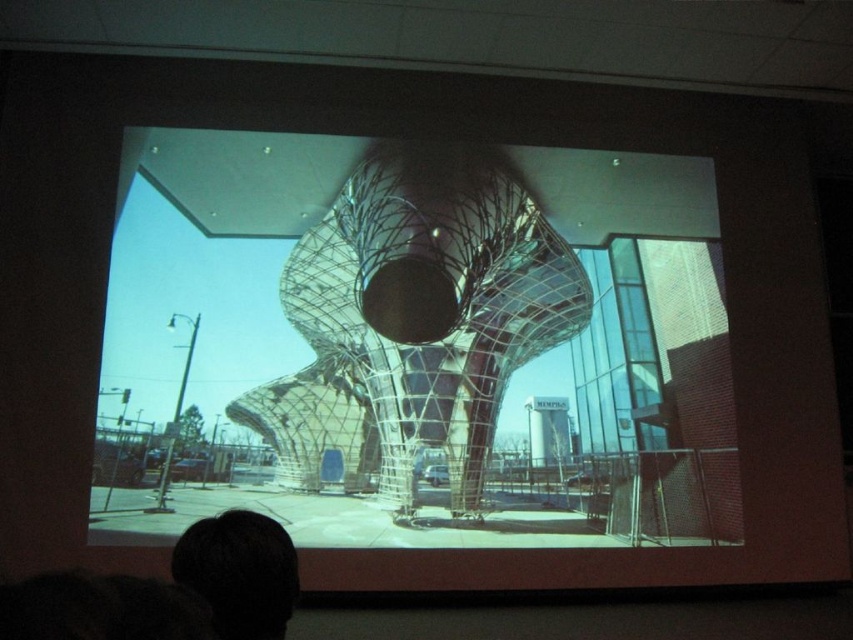
Question: Can you confirm if transparent glass sculpture at center is wider than dark hair at lower left?

Choices:
 (A) yes
 (B) no

Answer: (A)

Question: Is transparent glass sculpture at center thinner than dark hair at lower left?

Choices:
 (A) no
 (B) yes

Answer: (A)

Question: Can you confirm if transparent glass sculpture at center is wider than dark hair at lower left?

Choices:
 (A) yes
 (B) no

Answer: (A)

Question: Among these points, which one is farthest from the camera?

Choices:
 (A) (643, 180)
 (B) (202, 566)

Answer: (A)